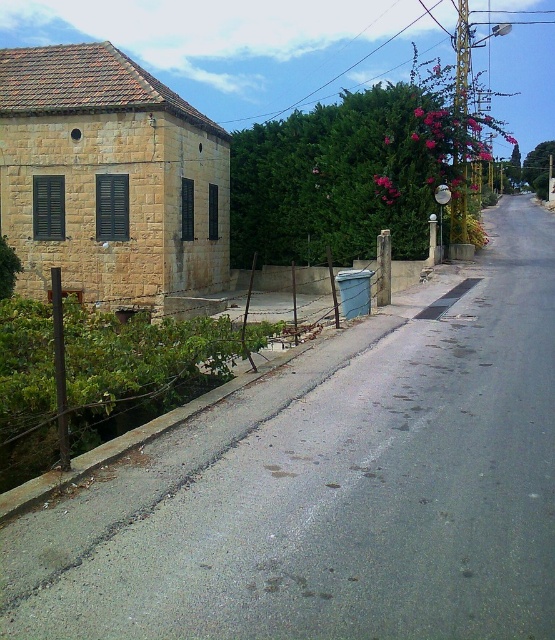
You are standing at the origin point of the coordinate system in this street scene. You need to walk to the gray asphalt road at center. What are the coordinates you need to move to?

The coordinates you need to move to are point (344, 492).

Consider the image. You are driving a delivery truck that requires a parking space. You see the gray asphalt road at center and the yellow stone building at left. Which area can accommodate your truck for parking?

The yellow stone building at left has a larger size compared to the gray asphalt road at center, so it can accommodate the delivery truck for parking.

You are standing at the point labeled point (39, 568) and want to walk to the point labeled point (104, 76). Based on the scene description, which direction should you move to reach your destination?

You should move towards the direction away from the house because point (39, 568) is in front of point (104, 76), meaning the destination is behind the starting point relative to the house.